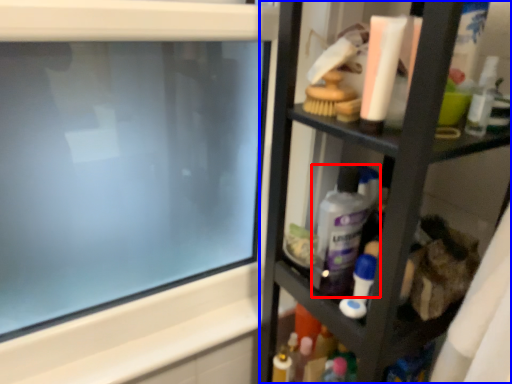
Question: Which point is closer to the camera, cleaning product (highlighted by a red box) or shelf (highlighted by a blue box)?

Choices:
 (A) cleaning product
 (B) shelf

Answer: (B)